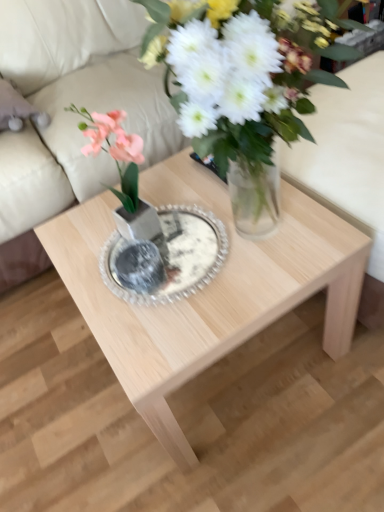
Question: Is beige fabric couch at upper center positioned far away from pink silk flower at center?

Choices:
 (A) no
 (B) yes

Answer: (A)

Question: From the image's perspective, is beige fabric couch at upper center over pink silk flower at center?

Choices:
 (A) no
 (B) yes

Answer: (B)

Question: Is beige fabric couch at upper center placed right next to pink silk flower at center?

Choices:
 (A) yes
 (B) no

Answer: (B)

Question: Is beige fabric couch at upper center closer to the viewer compared to pink silk flower at center?

Choices:
 (A) no
 (B) yes

Answer: (A)

Question: Is beige fabric couch at upper center outside pink silk flower at center?

Choices:
 (A) no
 (B) yes

Answer: (B)

Question: Is beige fabric couch at upper center positioned with its back to pink silk flower at center?

Choices:
 (A) no
 (B) yes

Answer: (A)

Question: From the image's perspective, is natural wood coffee table at center over clear glass plate at center?

Choices:
 (A) no
 (B) yes

Answer: (A)

Question: Considering the relative positions of natural wood coffee table at center and clear glass plate at center in the image provided, is natural wood coffee table at center to the left of clear glass plate at center from the viewer's perspective?

Choices:
 (A) no
 (B) yes

Answer: (A)

Question: Considering the relative positions of natural wood coffee table at center and clear glass plate at center in the image provided, is natural wood coffee table at center to the right of clear glass plate at center from the viewer's perspective?

Choices:
 (A) yes
 (B) no

Answer: (A)

Question: Is natural wood coffee table at center smaller than clear glass plate at center?

Choices:
 (A) no
 (B) yes

Answer: (A)

Question: Considering the relative sizes of natural wood coffee table at center and clear glass plate at center in the image provided, is natural wood coffee table at center wider than clear glass plate at center?

Choices:
 (A) yes
 (B) no

Answer: (A)

Question: Does natural wood coffee table at center have a greater height compared to clear glass plate at center?

Choices:
 (A) no
 (B) yes

Answer: (B)

Question: Does clear glass plate at center have a greater width compared to natural wood coffee table at center?

Choices:
 (A) yes
 (B) no

Answer: (B)